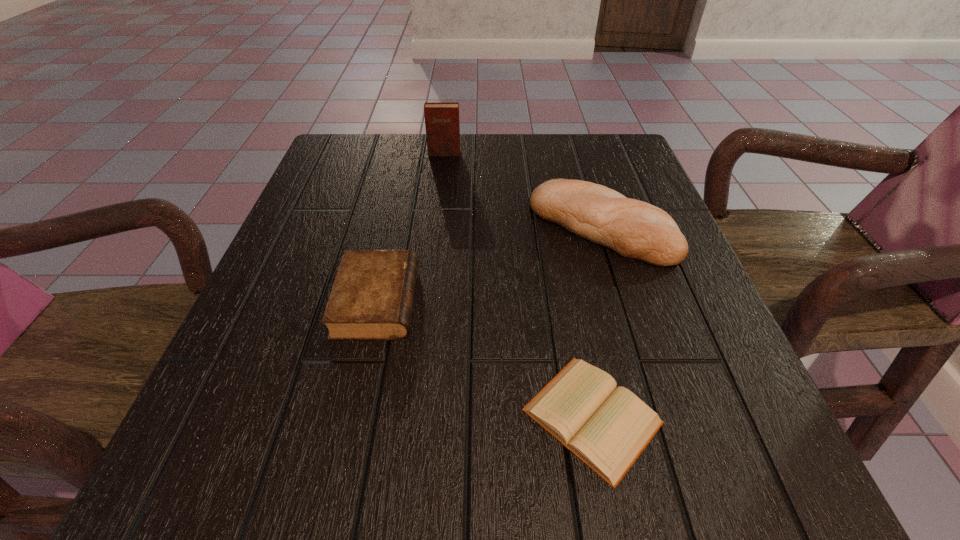
Find the location of a particular element. free point between the farthest diary and the third tallest object is located at coordinates (411, 227).

Image resolution: width=960 pixels, height=540 pixels. What are the coordinates of `unoccupied position between the nearest object and the third shortest object` in the screenshot? It's located at (597, 321).

Select which object appears as the third closest to the bread. Please provide its 2D coordinates. Your answer should be formatted as a tuple, i.e. [(x, y)], where the tuple contains the x and y coordinates of a point satisfying the conditions above.

[(442, 126)]

Locate an element on the screen. the third closest object to the tallest diary is located at coordinates (606, 427).

Locate which diary ranks in proximity to the tallest object. Please provide its 2D coordinates. Your answer should be formatted as a tuple, i.e. [(x, y)], where the tuple contains the x and y coordinates of a point satisfying the conditions above.

[(372, 296)]

Locate which diary ranks second in proximity to the second shortest object. Please provide its 2D coordinates. Your answer should be formatted as a tuple, i.e. [(x, y)], where the tuple contains the x and y coordinates of a point satisfying the conditions above.

[(442, 126)]

The width and height of the screenshot is (960, 540). Identify the location of blank space that satisfies the following two spatial constraints: 1. on the front cover of the tallest object; 2. on the left side of the shortest object. (415, 416).

Identify the location of free space in the image that satisfies the following two spatial constraints: 1. on the back side of the rightmost diary; 2. on the spine side of the third tallest object. Image resolution: width=960 pixels, height=540 pixels. (570, 301).

This screenshot has height=540, width=960. Identify the location of vacant region that satisfies the following two spatial constraints: 1. on the front side of the bread; 2. on the spine side of the second shortest diary. pos(624,301).

Find the location of `vacant space that satisfies the following two spatial constraints: 1. on the front cover of the farthest object; 2. on the right side of the shortest diary`. vacant space that satisfies the following two spatial constraints: 1. on the front cover of the farthest object; 2. on the right side of the shortest diary is located at coordinates (415, 416).